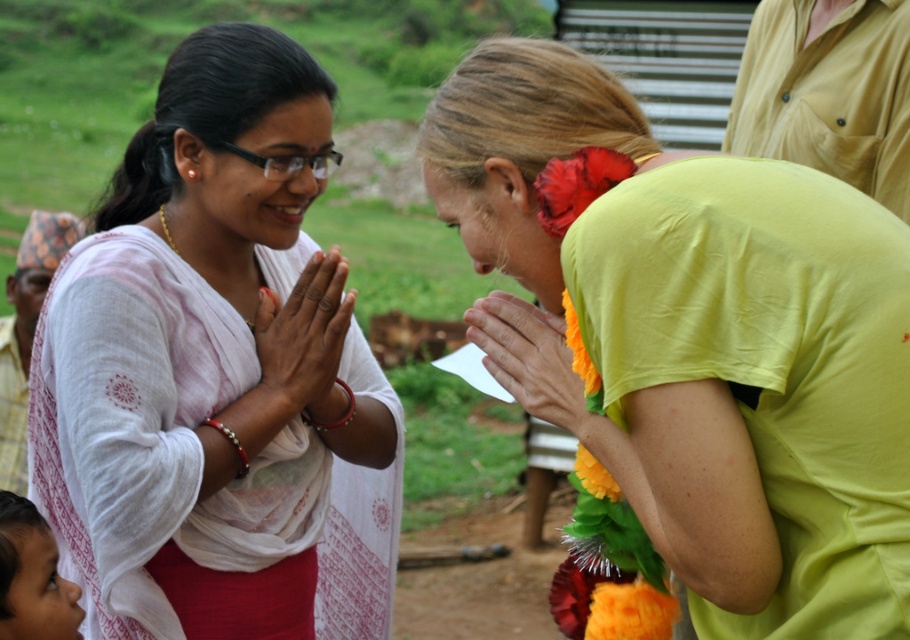
Question: Is white sheer sari at center smaller than orange fabric at center?

Choices:
 (A) no
 (B) yes

Answer: (A)

Question: Which object is positioned farthest from the yellow cotton shirt at center?

Choices:
 (A) white sheer sari at center
 (B) smooth skin face at lower left
 (C) matte white hands at center

Answer: (B)

Question: Estimate the real-world distances between objects in this image. Which object is farther from the yellow cotton shirt at center?

Choices:
 (A) matte white hands at center
 (B) white sheer sari at center
 (C) smooth skin face at lower left

Answer: (C)

Question: Does matte white hands at center have a smaller size compared to orange fabric at center?

Choices:
 (A) yes
 (B) no

Answer: (B)

Question: Is yellow cotton shirt at center above smooth skin face at lower left?

Choices:
 (A) no
 (B) yes

Answer: (B)

Question: Which point appears farthest from the camera in this image?

Choices:
 (A) (339, 310)
 (B) (767, 627)
 (C) (29, 600)
 (D) (527, 385)

Answer: (A)